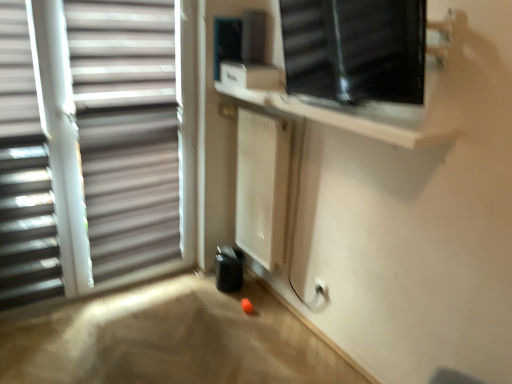
Question: Is transparent glass window at upper right, which is counted as the first window, starting from the right, thinner than white matte radiator at center?

Choices:
 (A) no
 (B) yes

Answer: (B)

Question: From the image's perspective, is transparent glass window at upper right, which is counted as the first window, starting from the right, beneath white matte radiator at center?

Choices:
 (A) no
 (B) yes

Answer: (A)

Question: Could you tell me if transparent glass window at upper right, marked as the second window in a left-to-right arrangement, is turned towards white matte radiator at center?

Choices:
 (A) yes
 (B) no

Answer: (B)

Question: Is transparent glass window at upper right, marked as the second window in a left-to-right arrangement, to the left of white matte radiator at center from the viewer's perspective?

Choices:
 (A) no
 (B) yes

Answer: (A)

Question: From a real-world perspective, is transparent glass window at upper right, marked as the second window in a left-to-right arrangement, on top of white matte radiator at center?

Choices:
 (A) no
 (B) yes

Answer: (B)

Question: Is transparent glass window at upper right, which is counted as the first window, starting from the right, surrounding white matte radiator at center?

Choices:
 (A) yes
 (B) no

Answer: (B)

Question: Does white matte window at left, which is counted as the 2th window, starting from the right, have a lesser height compared to transparent glass window at upper right, marked as the second window in a left-to-right arrangement?

Choices:
 (A) no
 (B) yes

Answer: (A)

Question: Can you confirm if white matte window at left, which is counted as the 2th window, starting from the right, is smaller than transparent glass window at upper right, marked as the second window in a left-to-right arrangement?

Choices:
 (A) yes
 (B) no

Answer: (B)

Question: Does white matte window at left, which appears as the first window when viewed from the left, appear on the left side of transparent glass window at upper right, marked as the second window in a left-to-right arrangement?

Choices:
 (A) yes
 (B) no

Answer: (A)

Question: Considering the relative sizes of white matte window at left, which is counted as the 2th window, starting from the right, and transparent glass window at upper right, marked as the second window in a left-to-right arrangement, in the image provided, is white matte window at left, which is counted as the 2th window, starting from the right, wider than transparent glass window at upper right, marked as the second window in a left-to-right arrangement,?

Choices:
 (A) yes
 (B) no

Answer: (B)

Question: Would you say transparent glass window at upper right, which is counted as the first window, starting from the right, is part of white matte window at left, which is counted as the 2th window, starting from the right,'s contents?

Choices:
 (A) no
 (B) yes

Answer: (A)

Question: From a real-world perspective, is white matte window at left, which appears as the first window when viewed from the left, on top of transparent glass window at upper right, which is counted as the first window, starting from the right?

Choices:
 (A) yes
 (B) no

Answer: (B)

Question: Is white matte radiator at center to the left of white matte window blind at left from the viewer's perspective?

Choices:
 (A) yes
 (B) no

Answer: (B)